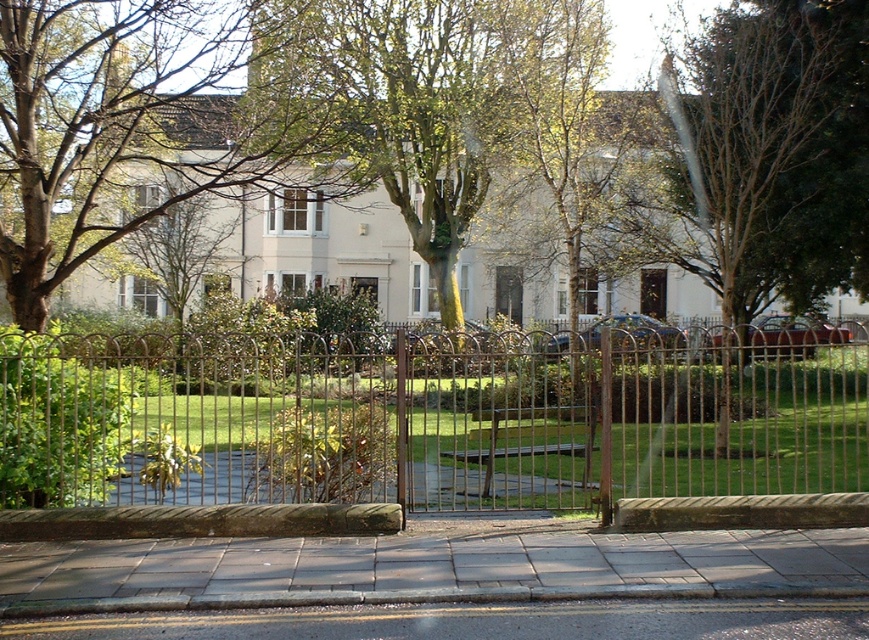
Question: Does green textured tree at center have a smaller size compared to gray concrete pavement at lower center?

Choices:
 (A) yes
 (B) no

Answer: (B)

Question: Which of the following is the farthest from the observer?

Choices:
 (A) (717, 417)
 (B) (661, 282)
 (C) (791, 198)
 (D) (214, 632)

Answer: (B)

Question: Where is green leafy tree at center located in relation to matte white door at center in the image?

Choices:
 (A) right
 (B) left

Answer: (A)

Question: Considering the real-world distances, which object is farthest from the green leafy tree at center?

Choices:
 (A) green leafy tree at upper center
 (B) brown metal fence at center
 (C) matte white door at center
 (D) gray concrete pavement at lower center

Answer: (D)

Question: Which object appears farthest from the camera in this image?

Choices:
 (A) brown metal fence at center
 (B) brown wooden door at center
 (C) gray concrete pavement at center

Answer: (B)

Question: Where is matte white door at center located in relation to brown wooden door at center in the image?

Choices:
 (A) below
 (B) above

Answer: (B)